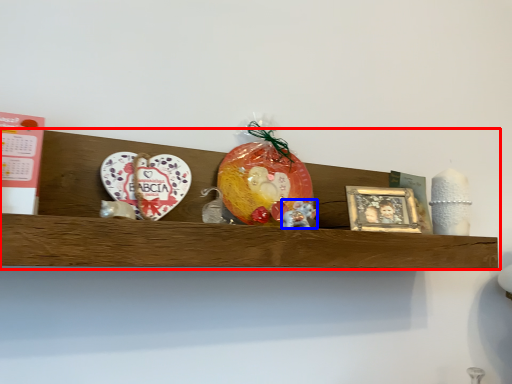
Question: Which point is further to the camera, shelf (highlighted by a red box) or stuff (highlighted by a blue box)?

Choices:
 (A) shelf
 (B) stuff

Answer: (B)